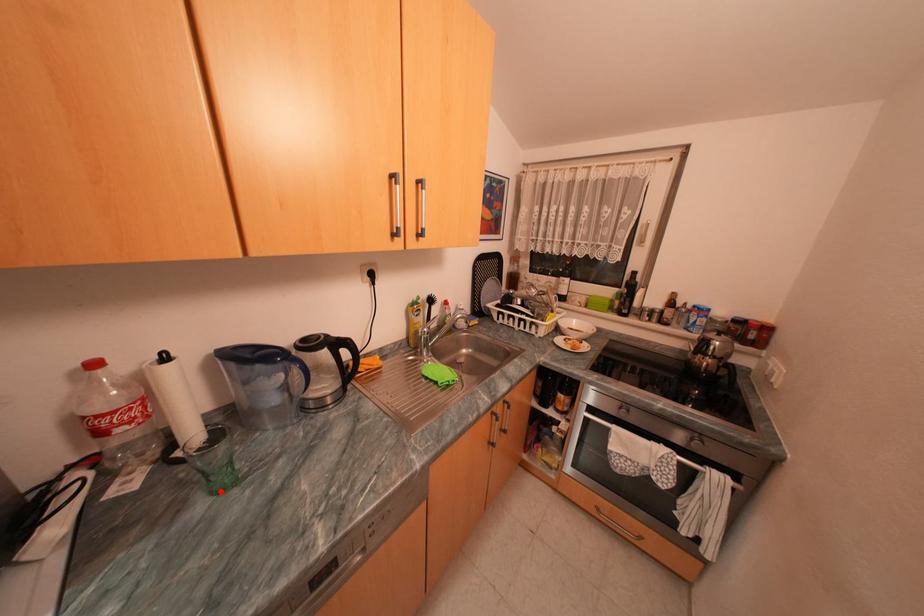
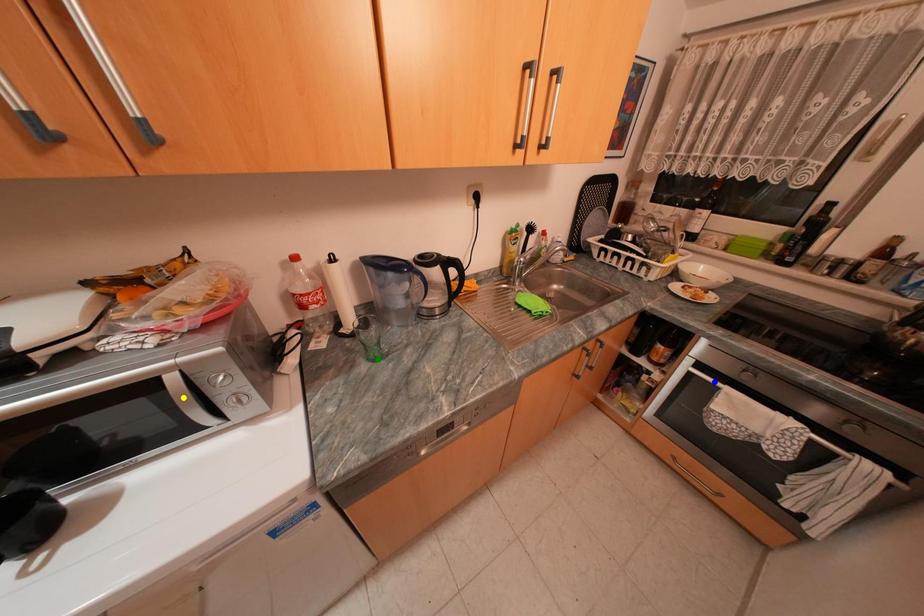
Question: I am providing you with two images of the same scene from different viewpoints. A red point is marked on the first image. You are given multiple points on the second image. Which mark in image 2 goes with the point in image 1?

Choices:
 (A) blue point
 (B) yellow point
 (C) green point

Answer: (C)